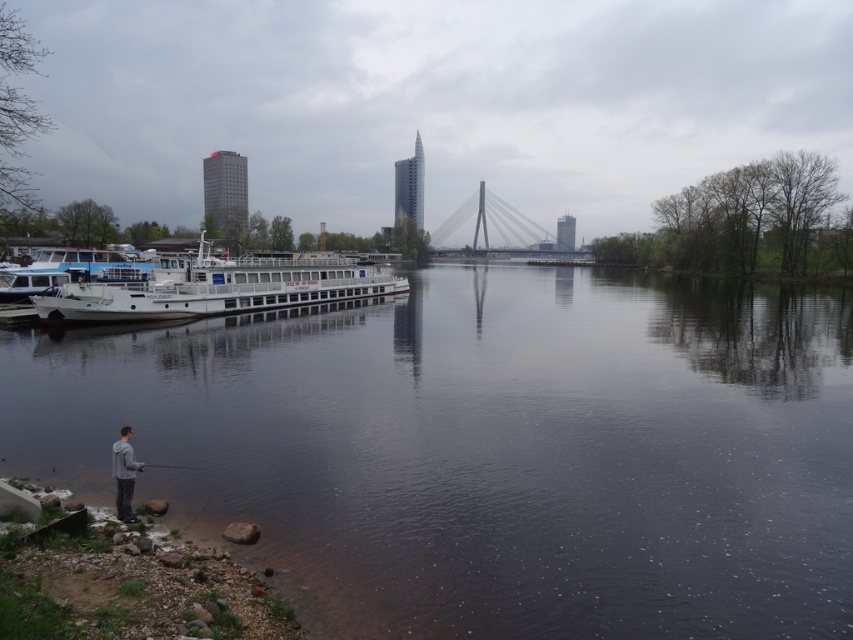
Who is higher up, dark reflective water at center or gray matte jacket at lower left?

Positioned higher is dark reflective water at center.

Locate an element on the screen. This screenshot has height=640, width=853. dark reflective water at center is located at coordinates (492, 449).

Identify the location of dark reflective water at center. (492, 449).

Is dark reflective water at center taller than white glossy boat at left?

Incorrect, dark reflective water at center's height is not larger of white glossy boat at left's.

Consider the image. Who is positioned more to the left, dark reflective water at center or white glossy boat at left?

white glossy boat at left

Is point (572, 618) positioned behind point (293, 262)?

No, it is not.

The width and height of the screenshot is (853, 640). Find the location of `dark reflective water at center`. dark reflective water at center is located at coordinates (492, 449).

Which is more to the right, white glossy boat at left or gray matte jacket at lower left?

gray matte jacket at lower left

Who is positioned more to the left, white glossy boat at left or gray matte jacket at lower left?

From the viewer's perspective, white glossy boat at left appears more on the left side.

Where is `white glossy boat at left`? Image resolution: width=853 pixels, height=640 pixels. white glossy boat at left is located at coordinates click(218, 288).